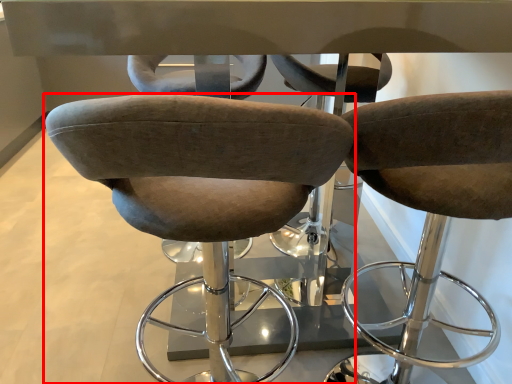
Question: From the image's perspective, where is chair (annotated by the red box) located relative to chair?

Choices:
 (A) above
 (B) below

Answer: (B)